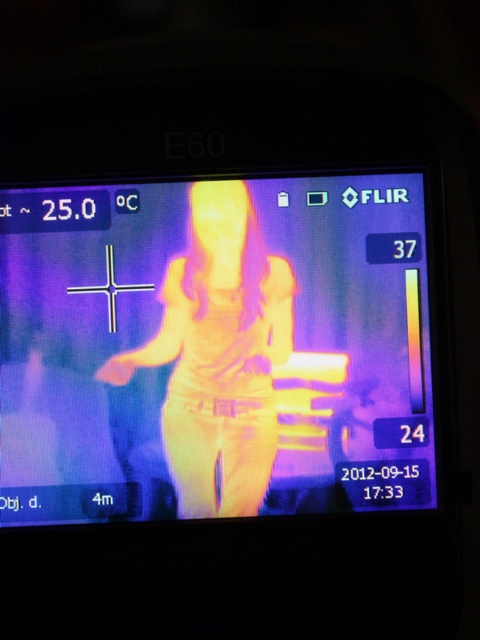
Between yellow metallic phone at center and yellow-orange fabric at center, which one has less height?

With less height is yellow-orange fabric at center.

Is point (239, 422) farther from viewer compared to point (254, 428)?

No, (239, 422) is in front of (254, 428).

Identify the location of yellow metallic phone at center. This screenshot has height=640, width=480. pos(215,348).